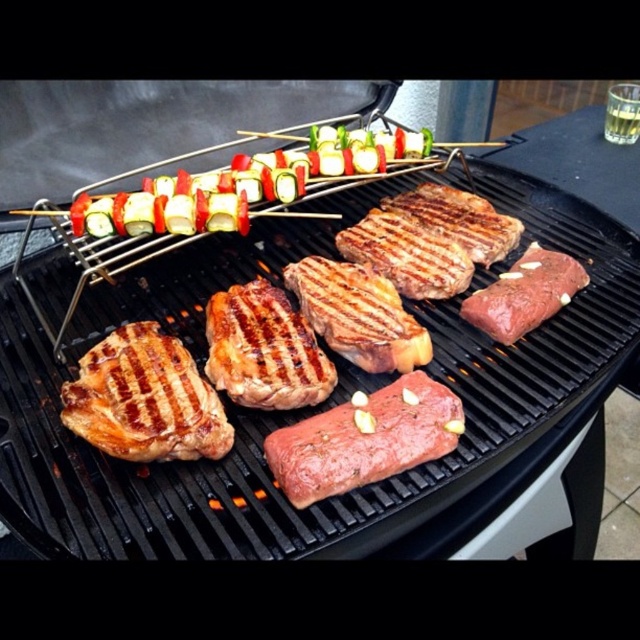
Can you confirm if grilled brown steak at center-left is positioned to the left of raw pink steak at center?

Yes, grilled brown steak at center-left is to the left of raw pink steak at center.

Is point (172, 412) behind point (362, 483)?

That is True.

Does point (227, 424) come farther from viewer compared to point (397, 429)?

Yes.

Locate an element on the screen. This screenshot has width=640, height=640. grilled brown steak at center-left is located at coordinates (145, 400).

Does grilled brown steak at center appear under raw red steak at center?

Indeed, grilled brown steak at center is positioned under raw red steak at center.

Looking at this image, can you confirm if grilled brown steak at center is shorter than raw red steak at center?

In fact, grilled brown steak at center may be taller than raw red steak at center.

The width and height of the screenshot is (640, 640). What do you see at coordinates (264, 349) in the screenshot? I see `grilled brown steak at center` at bounding box center [264, 349].

At what (x,y) coordinates should I click in order to perform the action: click on grilled brown steak at center. Please return your answer as a coordinate pair (x, y). Image resolution: width=640 pixels, height=640 pixels. Looking at the image, I should click on pos(264,349).

Does grilled meat at center appear on the left side of multicolored vegetable skewers at center?

In fact, grilled meat at center is to the right of multicolored vegetable skewers at center.

Does grilled meat at center have a smaller size compared to multicolored vegetable skewers at center?

No.

What do you see at coordinates (310, 406) in the screenshot? This screenshot has height=640, width=640. I see `grilled meat at center` at bounding box center [310, 406].

Where is `grilled meat at center`? This screenshot has height=640, width=640. grilled meat at center is located at coordinates (310, 406).